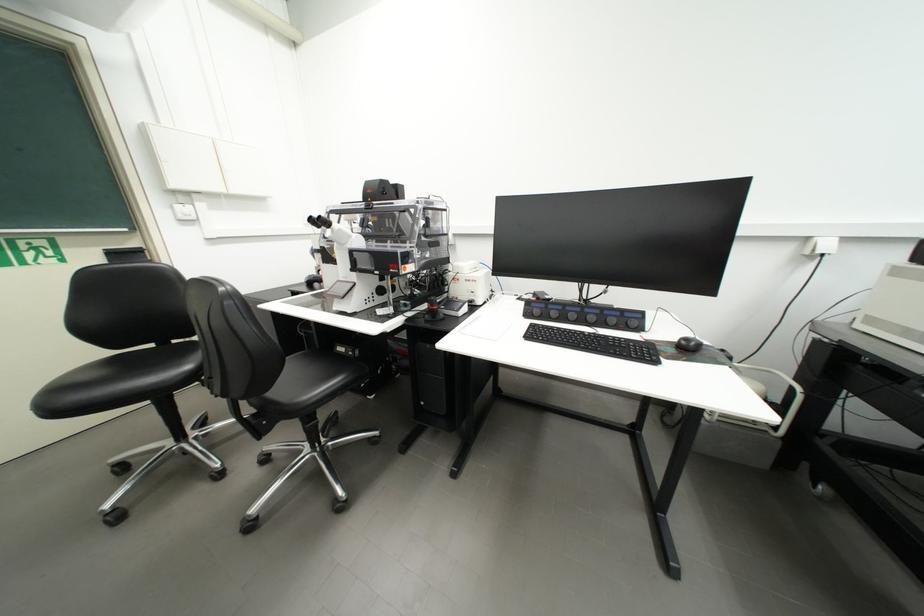
Find the location of a particular element. The height and width of the screenshot is (616, 924). black computer keyboard is located at coordinates (593, 342).